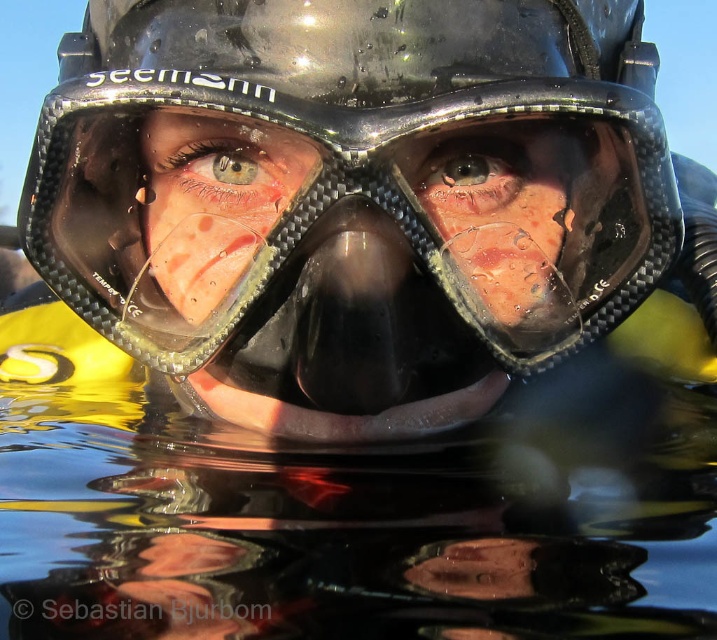
How much distance is there between matte black scuba mask at center and blue glossy eye at center?

matte black scuba mask at center is 3.26 inches from blue glossy eye at center.

Is matte black scuba mask at center to the left of blue glossy eye at center from the viewer's perspective?

Incorrect, matte black scuba mask at center is not on the left side of blue glossy eye at center.

Which is in front, point (559, 192) or point (272, 189)?

Positioned in front is point (272, 189).

Locate an element on the screen. matte black scuba mask at center is located at coordinates point(498,225).

Which of these two, black matte helmet at center or matte rubber face at center, stands taller?

black matte helmet at center

You are a GUI agent. You are given a task and a screenshot of the screen. Output one action in this format:
    pyautogui.click(x=<x>, y=<y>)
    Task: Click on the black matte helmet at center
    The image size is (717, 640).
    Given the screenshot: What is the action you would take?
    pyautogui.click(x=353, y=189)

Is point (326, 241) positioned after point (186, 125)?

No.

Where is `black matte helmet at center`? This screenshot has height=640, width=717. black matte helmet at center is located at coordinates (353, 189).

Is blue glossy eye at center shorter than clear glass eye at center?

Incorrect, blue glossy eye at center's height does not fall short of clear glass eye at center's.

Image resolution: width=717 pixels, height=640 pixels. Identify the location of blue glossy eye at center. (222, 170).